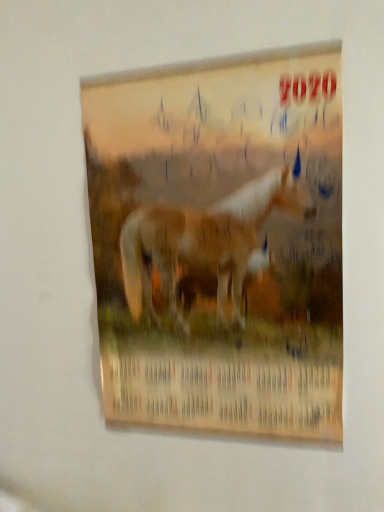
What do you see at coordinates (220, 243) in the screenshot? I see `matte paper poster at center` at bounding box center [220, 243].

Find the location of a particular element. This screenshot has height=512, width=384. matte paper poster at center is located at coordinates (220, 243).

I want to click on matte paper poster at center, so click(220, 243).